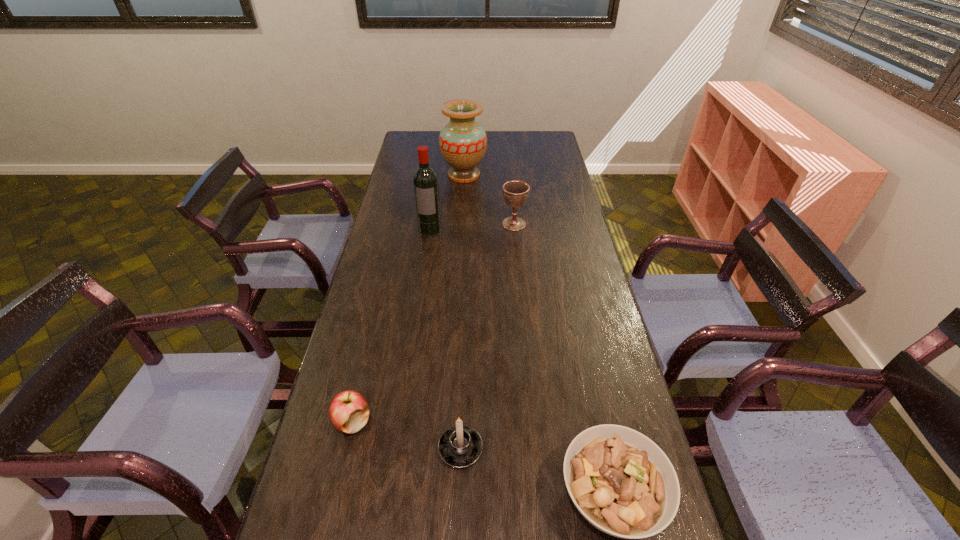
Image resolution: width=960 pixels, height=540 pixels. In order to click on wine bottle in this screenshot , I will do `click(425, 181)`.

Find the location of a particular element. The height and width of the screenshot is (540, 960). the farthest object is located at coordinates (463, 142).

The height and width of the screenshot is (540, 960). I want to click on chalice, so click(515, 192).

Identify the location of candle holder. This screenshot has height=540, width=960. (460, 446).

At what (x,y) coordinates should I click in order to perform the action: click on the leftmost object. Please return your answer as a coordinate pair (x, y). Looking at the image, I should click on (349, 411).

The width and height of the screenshot is (960, 540). I want to click on vacant space situated 0.130m on the label of the wine bottle, so click(x=426, y=256).

Identify the location of free space located 0.240m on the right of the vase. Image resolution: width=960 pixels, height=540 pixels. (538, 176).

Where is `free location located 0.260m on the back of the chalice`? free location located 0.260m on the back of the chalice is located at coordinates (510, 185).

Locate an element on the screen. free space located 0.200m with a handle on the side of the candle holder is located at coordinates (464, 364).

Image resolution: width=960 pixels, height=540 pixels. I want to click on blank area located 0.320m with a handle on the side of the candle holder, so click(465, 333).